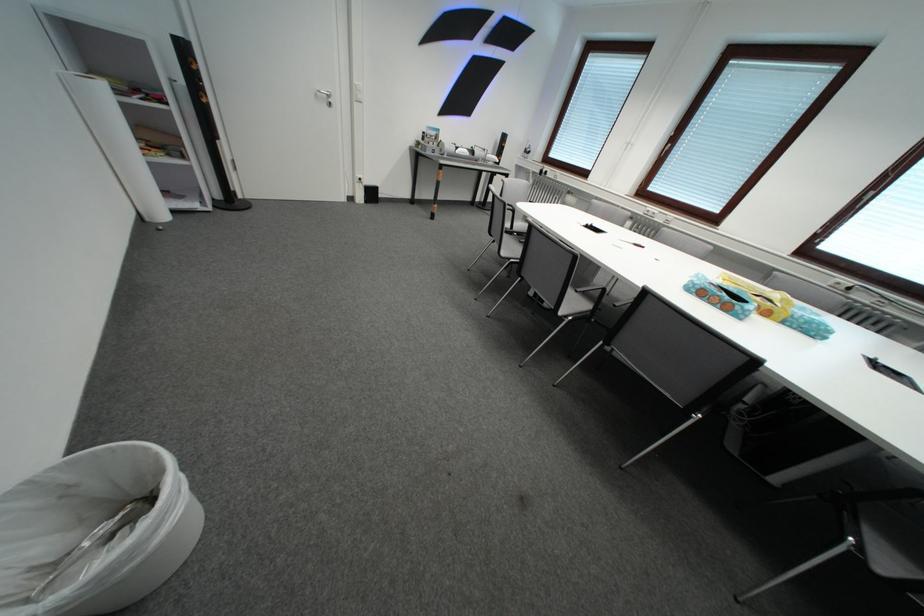
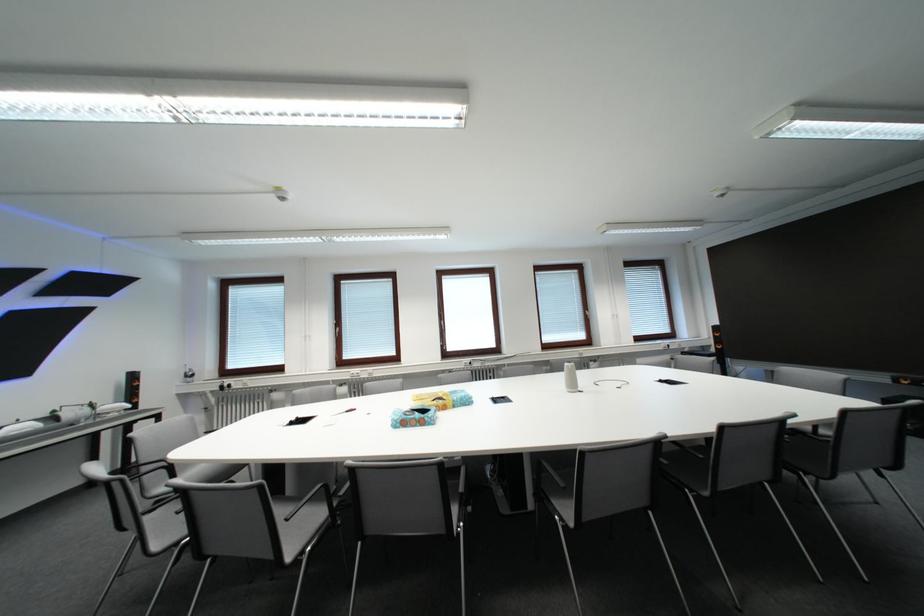
Question: Based on the continuous images, in which direction is the camera rotating? Reply with the corresponding letter.

Choices:
 (A) Left
 (B) Right
 (C) Up
 (D) Down

Answer: (B)